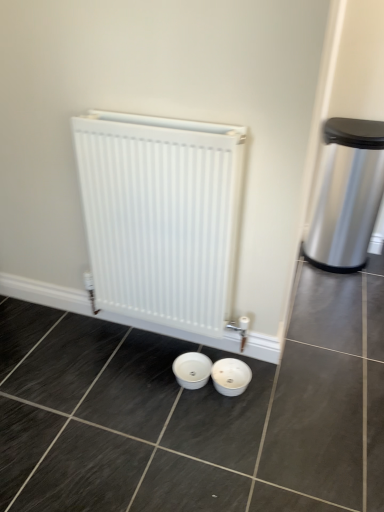
Find the location of `spots to the right of white matte radiator at center`. spots to the right of white matte radiator at center is located at coordinates (309, 372).